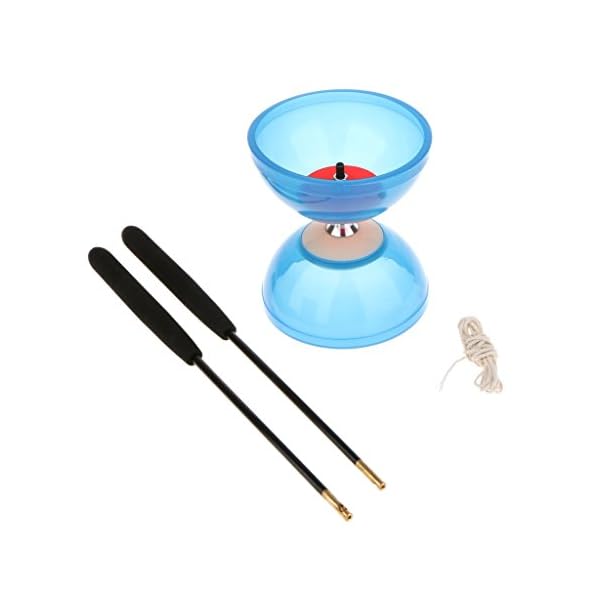
Locate an element on the screen. This screenshot has width=600, height=600. handle is located at coordinates (123, 293), (196, 285).